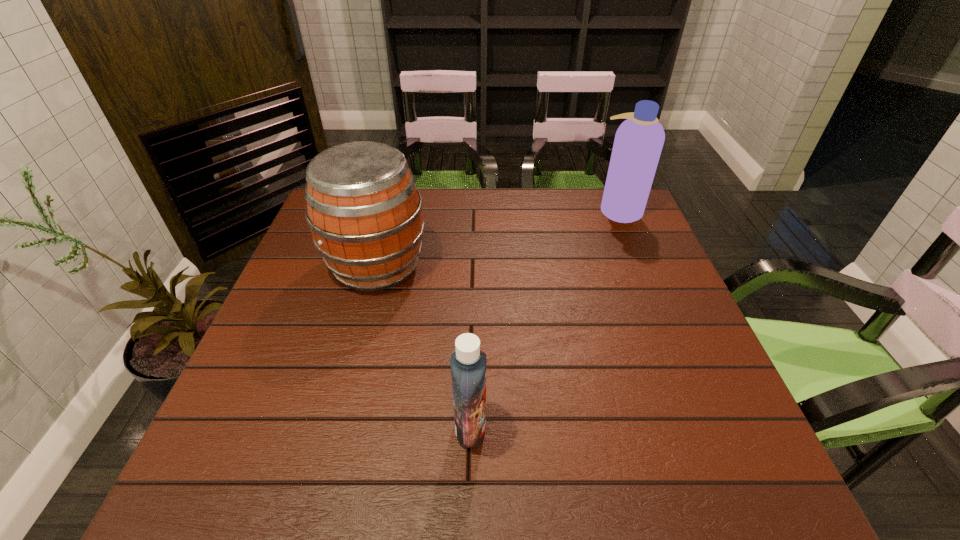
The width and height of the screenshot is (960, 540). Identify the location of the farthest object. (638, 143).

Locate an element on the screen. This screenshot has width=960, height=540. the rightmost object is located at coordinates (638, 143).

I want to click on the second nearest object, so click(x=364, y=211).

The width and height of the screenshot is (960, 540). In order to click on the leftmost object in this screenshot , I will do `click(364, 211)`.

This screenshot has height=540, width=960. Find the location of `the left shampoo`. the left shampoo is located at coordinates (468, 361).

The image size is (960, 540). I want to click on the nearest object, so click(x=468, y=361).

The image size is (960, 540). What are the coordinates of `vacant area situated 0.130m on the left of the rightmost object` in the screenshot? It's located at click(557, 210).

Identify the location of free region located on the back of the second nearest object. (389, 221).

Where is `vacant space situated on the front label of the shortest object`? The height and width of the screenshot is (540, 960). vacant space situated on the front label of the shortest object is located at coordinates (580, 427).

Find the location of `object situated at the far edge`. object situated at the far edge is located at coordinates (638, 143).